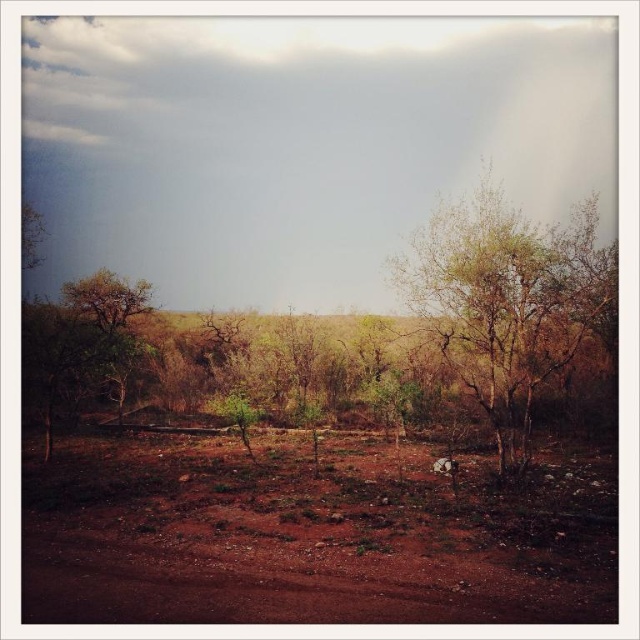
Based on the photo, does brown soil at center have a larger size compared to green leafy tree at center?

No.

Which is below, brown soil at center or green leafy tree at center?

brown soil at center

Is point (26, 499) positioned in front of point (442, 337)?

Yes, point (26, 499) is in front of point (442, 337).

Locate an element on the screen. brown soil at center is located at coordinates (x=305, y=536).